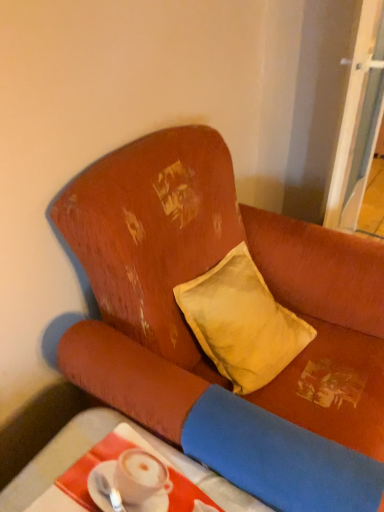
At what (x,y) coordinates should I click in order to perform the action: click on vacant space behind white glossy spoon at lower left. Please return your answer as a coordinate pair (x, y). The height and width of the screenshot is (512, 384). Looking at the image, I should click on (119, 453).